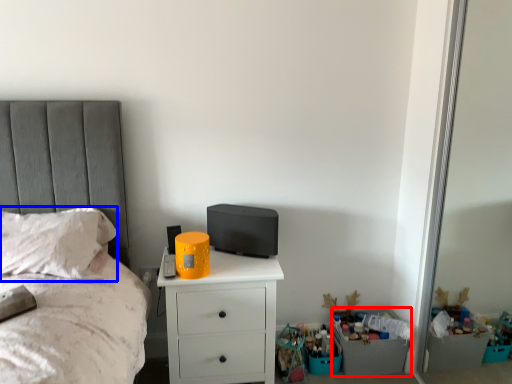
Question: Which object is further to the camera taking this photo, crate (highlighted by a red box) or pillow (highlighted by a blue box)?

Choices:
 (A) crate
 (B) pillow

Answer: (A)